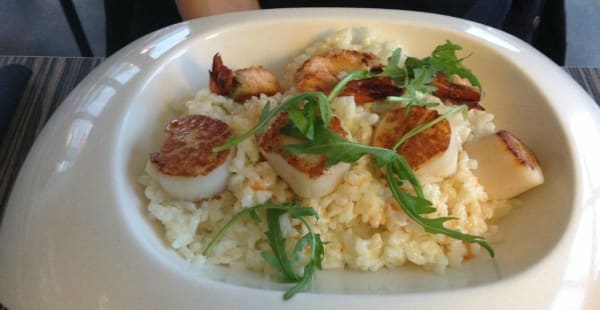
You are a GUI agent. You are given a task and a screenshot of the screen. Output one action in this format:
    pyautogui.click(x=<x>, y=<y>)
    Task: Click on the grayish white rim of plate
    This screenshot has width=600, height=310.
    Given the screenshot: What is the action you would take?
    pyautogui.click(x=100, y=232), pyautogui.click(x=118, y=289), pyautogui.click(x=520, y=292), pyautogui.click(x=43, y=253)